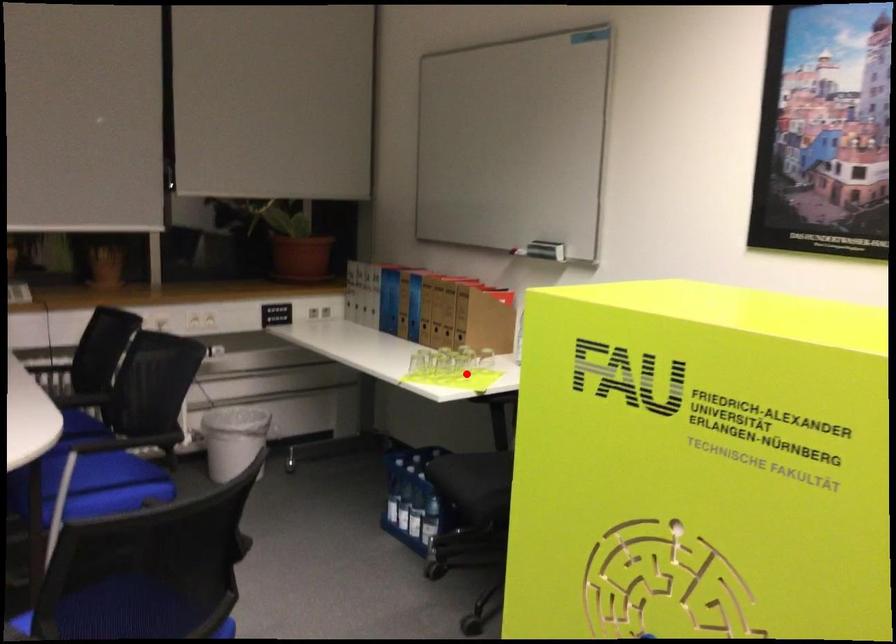
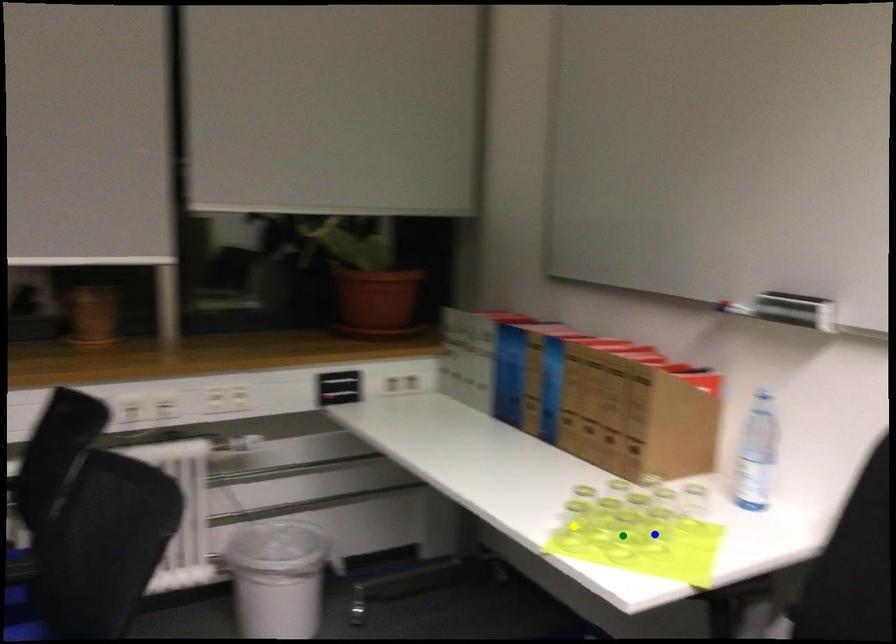
Question: I am providing you with two images of the same scene from different viewpoints. A red point is marked on the first image. You are given multiple points on the second image. Which point in image 2 is actually the same real-world point as the red point in image 1?

Choices:
 (A) green point
 (B) blue point
 (C) yellow point

Answer: (B)